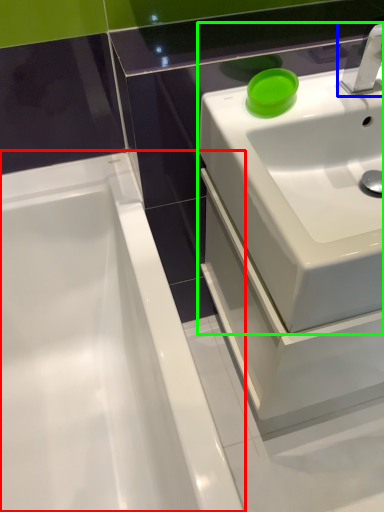
Question: Which object is positioned closest to bathtub (highlighted by a red box)? Select from tap (highlighted by a blue box) and sink (highlighted by a green box).

Choices:
 (A) tap
 (B) sink

Answer: (B)